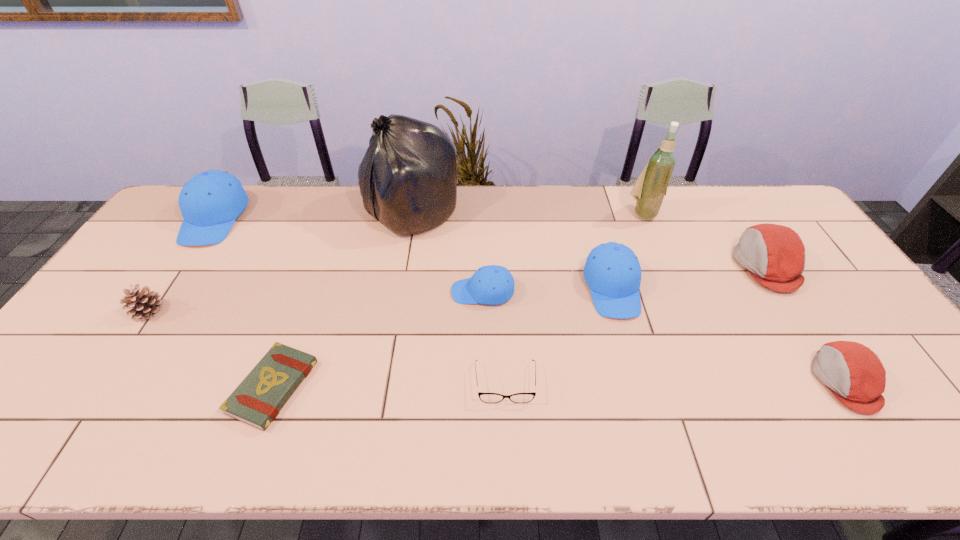
What are the coordinates of `vacant space positioned 0.220m on the right of the brown book` in the screenshot? It's located at (404, 387).

Where is `plastic bag at the far edge`? plastic bag at the far edge is located at coordinates (407, 178).

This screenshot has width=960, height=540. Identify the location of wine bottle that is at the far edge. (649, 191).

Identify the location of cap that is at the far edge. Image resolution: width=960 pixels, height=540 pixels. (210, 201).

Locate an element on the screen. The image size is (960, 540). cap that is at the near edge is located at coordinates (855, 375).

What are the coordinates of `book present at the near edge` in the screenshot? It's located at (258, 399).

Image resolution: width=960 pixels, height=540 pixels. Identify the location of cap present at the left edge. (210, 201).

You are a GUI agent. You are given a task and a screenshot of the screen. Output one action in this format:
    pyautogui.click(x=<x>, y=<y>)
    Task: Click on the pinecone at the left edge
    This screenshot has width=960, height=540.
    Given the screenshot: What is the action you would take?
    pyautogui.click(x=144, y=304)

Where is `object present at the far left corner`? This screenshot has width=960, height=540. object present at the far left corner is located at coordinates (210, 201).

Image resolution: width=960 pixels, height=540 pixels. Identify the location of object situated at the near right corner. (855, 375).